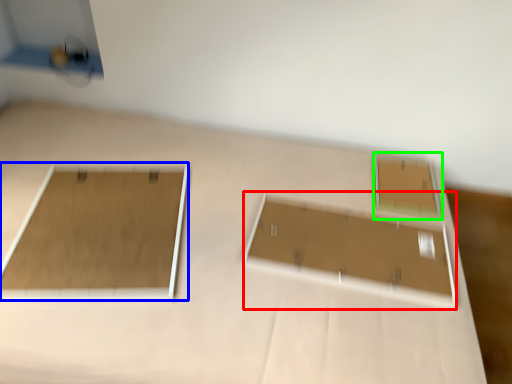
Question: Considering the real-world distances, which object is closest to rectangle (highlighted by a red box)? rectangle (highlighted by a blue box) or rectangle (highlighted by a green box).

Choices:
 (A) rectangle
 (B) rectangle

Answer: (B)